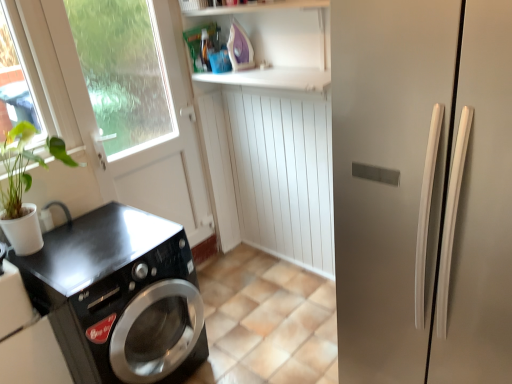
Locate an element on the screen. vacant space to the right of black glossy screen door at left is located at coordinates (229, 274).